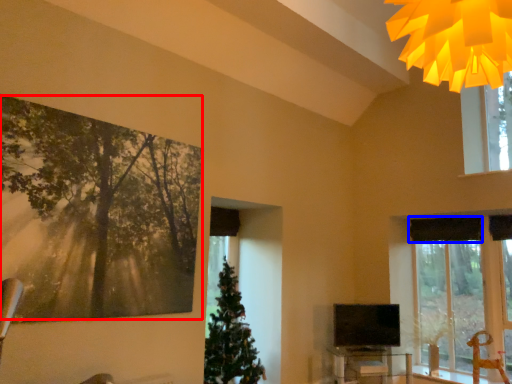
Question: Among these objects, which one is nearest to the camera, tree (highlighted by a red box) or curtain (highlighted by a blue box)?

Choices:
 (A) tree
 (B) curtain

Answer: (A)